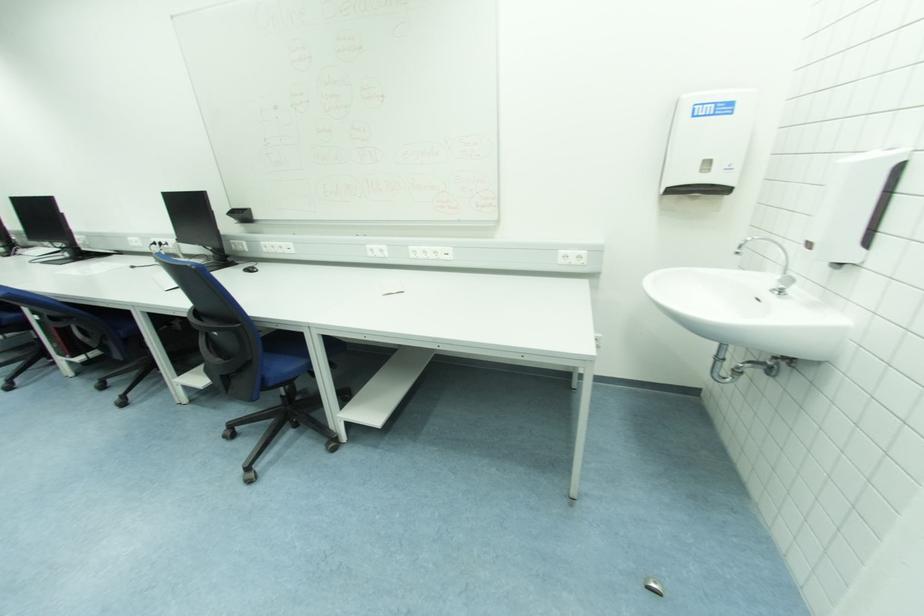
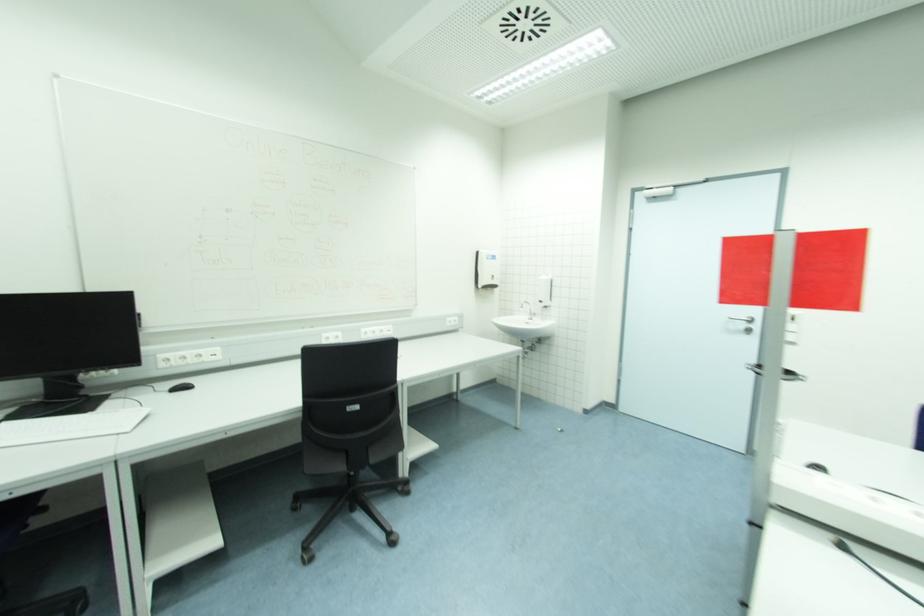
The point at (257, 270) is marked in the first image. Where is the corresponding point in the second image?

(192, 386)